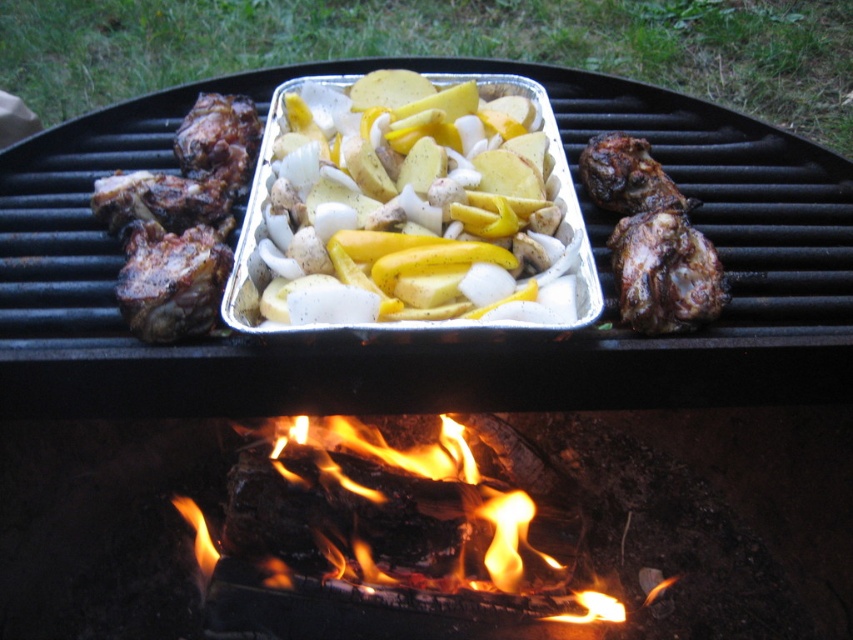
Question: Which object is positioned closest to the brown crispy bone-in meat at left?

Choices:
 (A) yellow matte potatoes at center
 (B) flamewood at center

Answer: (A)

Question: Which object is positioned farthest from the yellow matte potatoes at center?

Choices:
 (A) flamewood at center
 (B) brown crispy bone-in meat at left

Answer: (A)

Question: Observing the image, what is the correct spatial positioning of yellow matte potatoes at center in reference to flamewood at center?

Choices:
 (A) above
 (B) below

Answer: (A)

Question: Which point is closer to the camera?

Choices:
 (A) (532, 180)
 (B) (564, 618)

Answer: (A)

Question: Is yellow matte potatoes at center below brown crispy bone-in meat at left?

Choices:
 (A) yes
 (B) no

Answer: (B)

Question: Is brown crispy bone-in meat at left below flamewood at center?

Choices:
 (A) no
 (B) yes

Answer: (A)